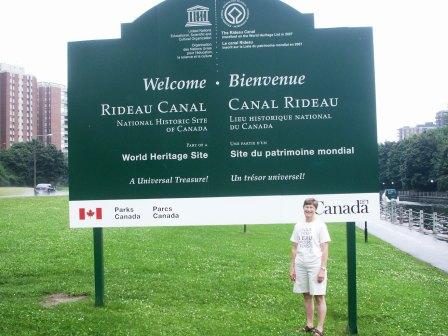
Find the location of a particular element. welcome sign is located at coordinates (237, 111).